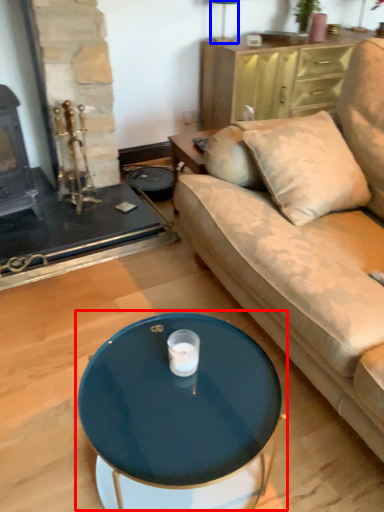
Question: Which of the following is the farthest to the observer, coffee table (highlighted by a red box) or lamp (highlighted by a blue box)?

Choices:
 (A) coffee table
 (B) lamp

Answer: (B)